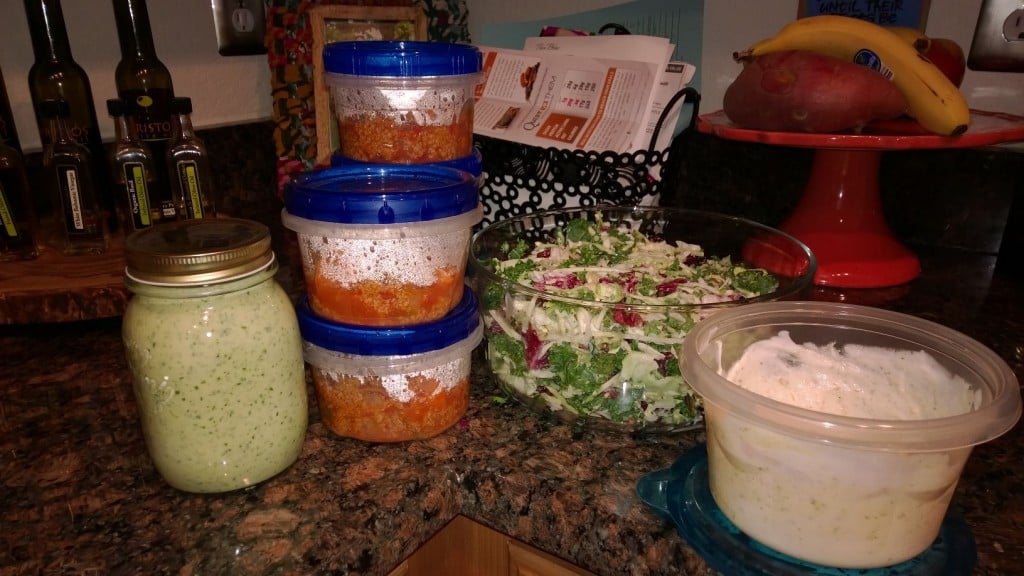
At what (x,y) coordinates should I click in order to perform the action: click on bottles. Please return your answer as a coordinate pair (x, y). Image resolution: width=1024 pixels, height=576 pixels. Looking at the image, I should click on (119, 191), (54, 197), (54, 123), (171, 102), (214, 183).